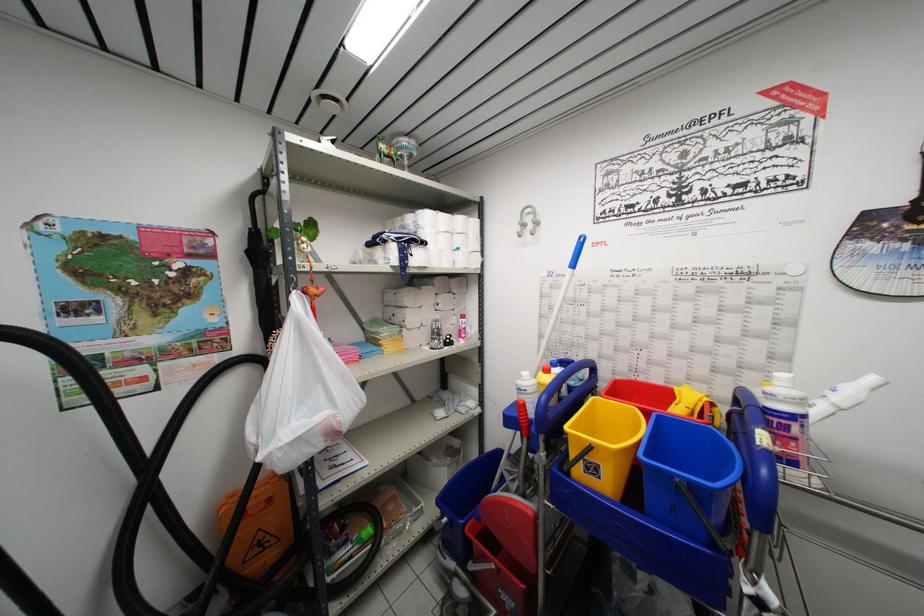
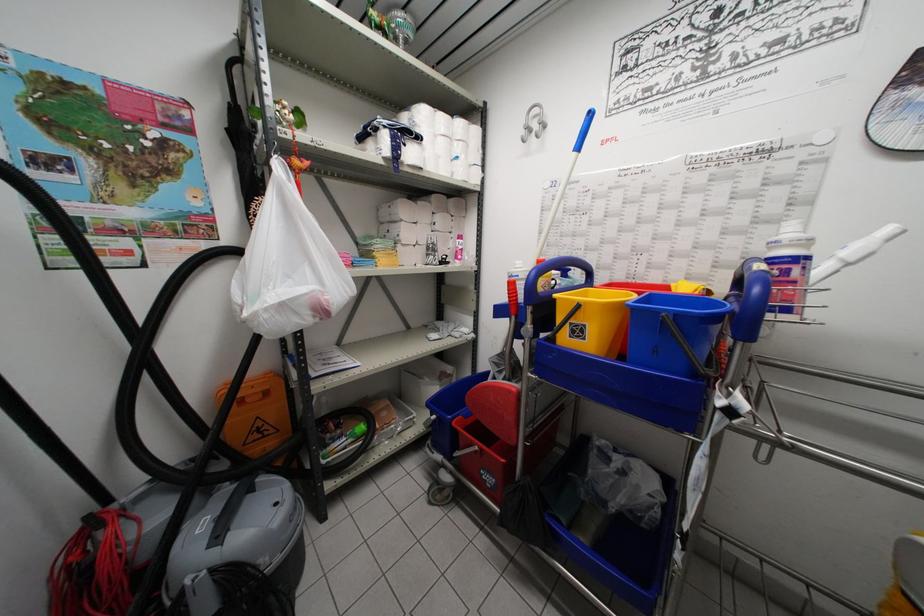
Question: In a continuous first-person perspective shot, in which direction is the camera moving?

Choices:
 (A) Left
 (B) Right
 (C) Forward
 (D) Backward

Answer: (B)